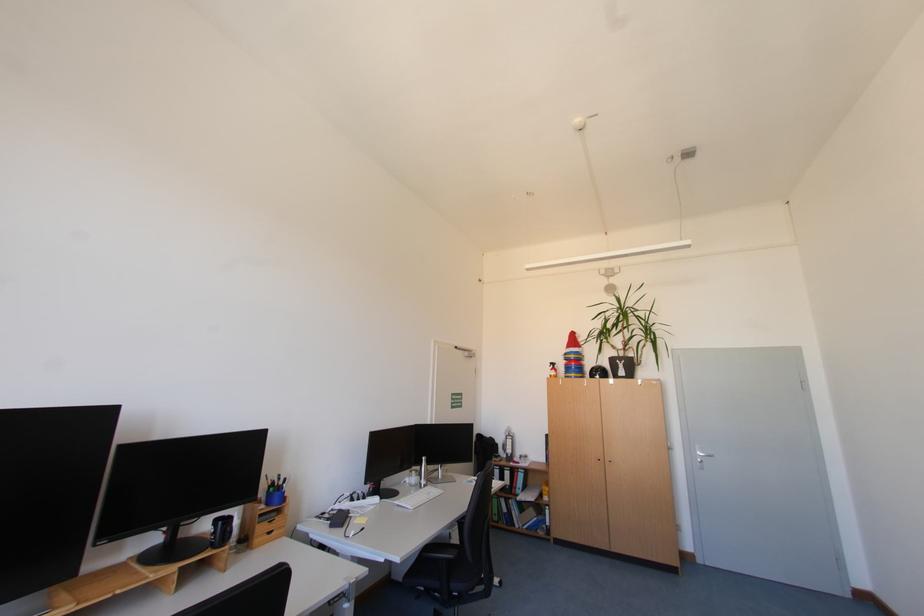
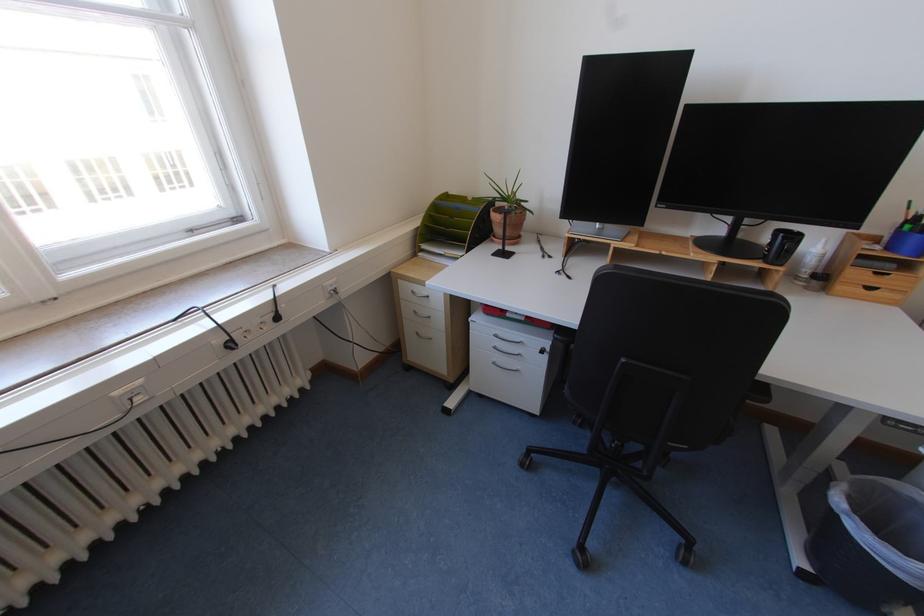
Find the pixel in the second image that matches (244,541) in the first image.

(818, 273)